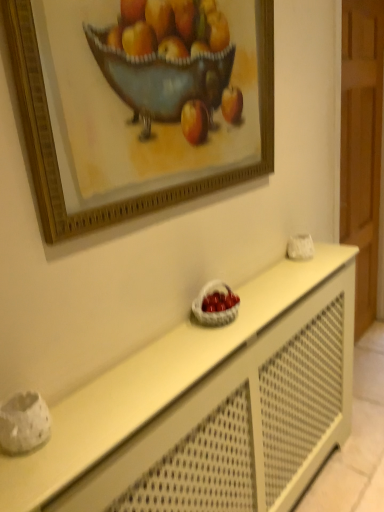
Find the location of a particular element. The height and width of the screenshot is (512, 384). vacant space to the right of white woven basket at center is located at coordinates (261, 306).